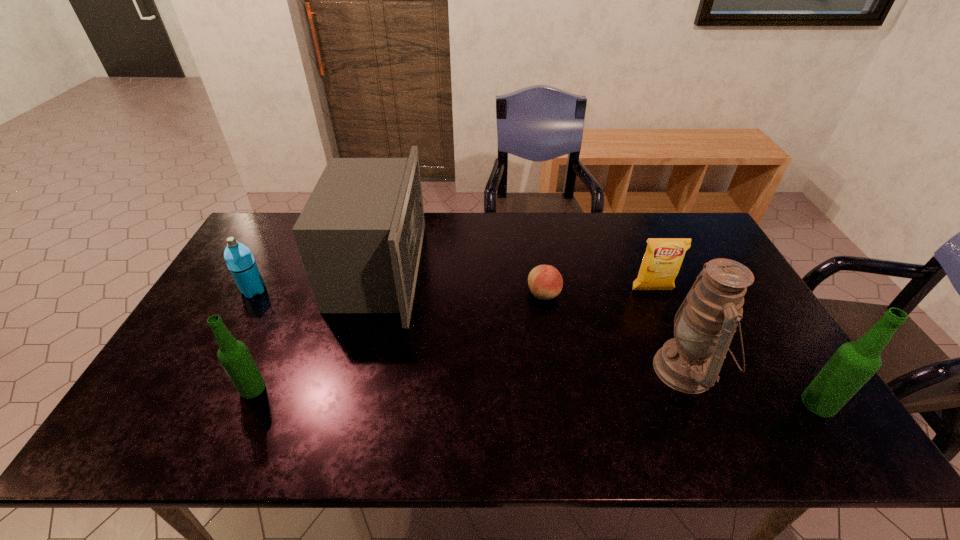
This screenshot has width=960, height=540. Find the location of `object that is at the left edge`. object that is at the left edge is located at coordinates (239, 259).

The width and height of the screenshot is (960, 540). Identify the location of object at the right edge. (854, 363).

Where is `object located in the near right corner section of the desktop`? This screenshot has height=540, width=960. object located in the near right corner section of the desktop is located at coordinates (854, 363).

I want to click on free location at the far edge, so click(454, 245).

Image resolution: width=960 pixels, height=540 pixels. I want to click on free location at the near edge of the desktop, so click(652, 403).

Image resolution: width=960 pixels, height=540 pixels. Identify the location of vacant point at the far left corner. (270, 252).

Where is `vacant space at the far right corner`? The width and height of the screenshot is (960, 540). vacant space at the far right corner is located at coordinates (703, 244).

Where is `free space at the near right corner of the desktop`? This screenshot has width=960, height=540. free space at the near right corner of the desktop is located at coordinates (768, 393).

This screenshot has height=540, width=960. In order to click on blank region between the crisp (potato chip) and the microwave oven in this screenshot , I will do tap(516, 280).

Where is `vacant point located between the oil lamp and the microwave oven`? vacant point located between the oil lamp and the microwave oven is located at coordinates (532, 320).